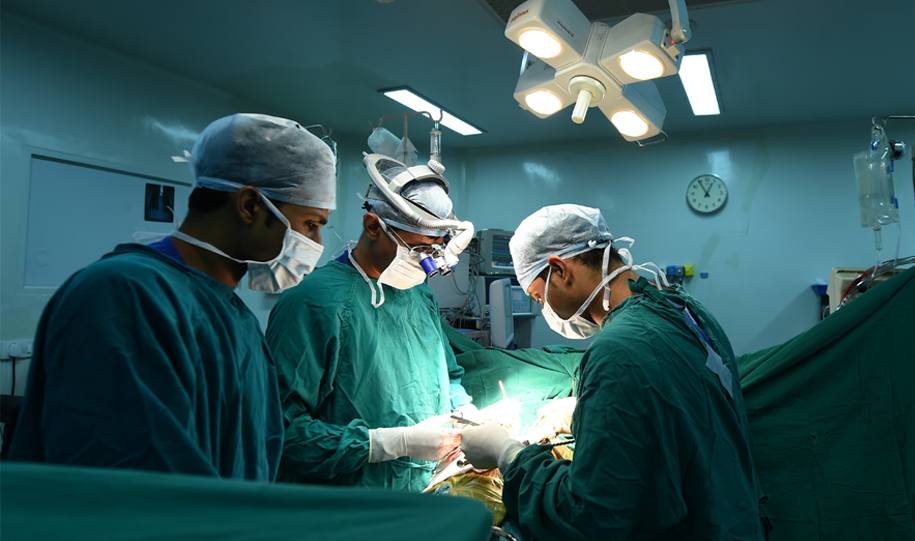
In order to click on ceiling in this screenshot , I will do `click(821, 41)`, `click(353, 49)`.